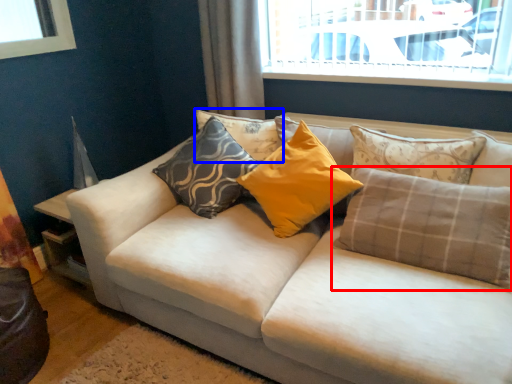
Question: Which of the following is the farthest to the observer, pillow (highlighted by a red box) or pillow (highlighted by a blue box)?

Choices:
 (A) pillow
 (B) pillow

Answer: (B)